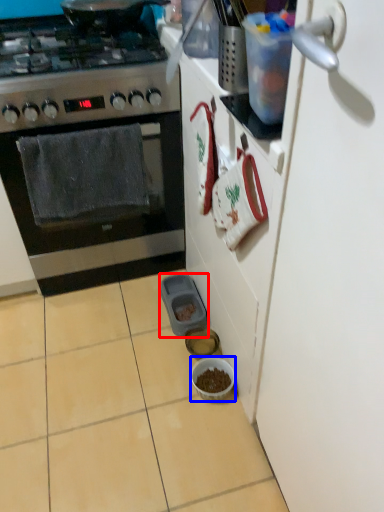
Question: Which object appears farthest to the camera in this image, appliance (highlighted by a red box) or bowl (highlighted by a blue box)?

Choices:
 (A) appliance
 (B) bowl

Answer: (A)